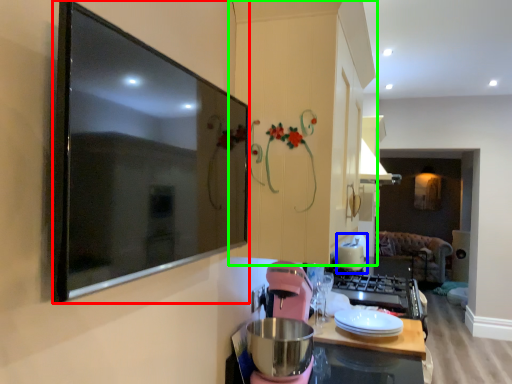
Question: Considering the real-world distances, which object is farthest from picture frame (highlighted by a red box)? appliance (highlighted by a blue box) or cabinetry (highlighted by a green box)?

Choices:
 (A) appliance
 (B) cabinetry

Answer: (A)